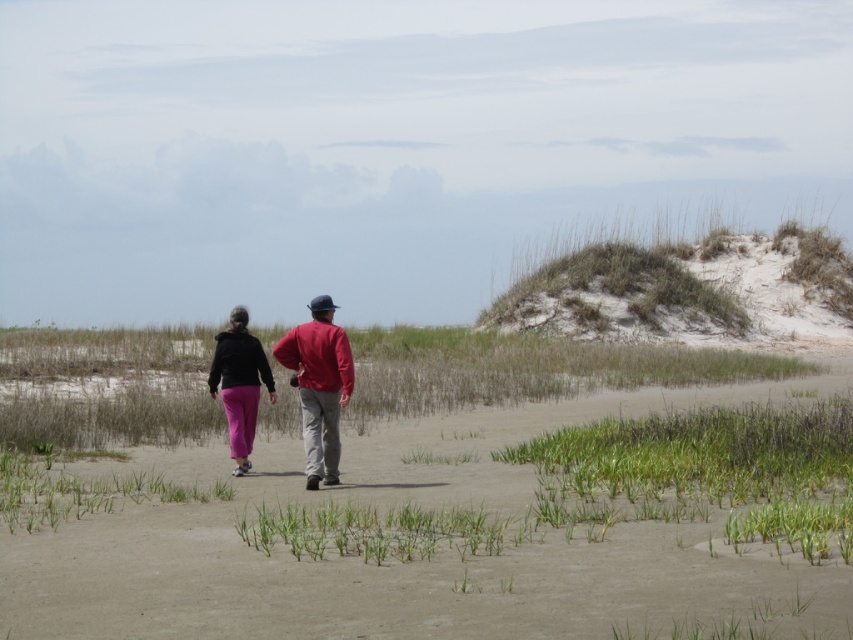
Question: Which point appears closest to the camera in this image?

Choices:
 (A) (244, 416)
 (B) (830, 296)
 (C) (300, 392)

Answer: (C)

Question: Which point appears farthest from the camera in this image?

Choices:
 (A) (318, 426)
 (B) (674, 244)
 (C) (238, 314)

Answer: (B)

Question: Is green grassy sand dune at upper right positioned before matte black jacket at center?

Choices:
 (A) no
 (B) yes

Answer: (A)

Question: Does green grassy sand dune at upper right come behind matte black jacket at center?

Choices:
 (A) yes
 (B) no

Answer: (A)

Question: Is the position of sandy beach at center less distant than that of green grassy sand dune at upper right?

Choices:
 (A) yes
 (B) no

Answer: (A)

Question: Which point is farther to the camera?

Choices:
 (A) (252, 500)
 (B) (221, 339)
 (C) (347, 348)

Answer: (B)